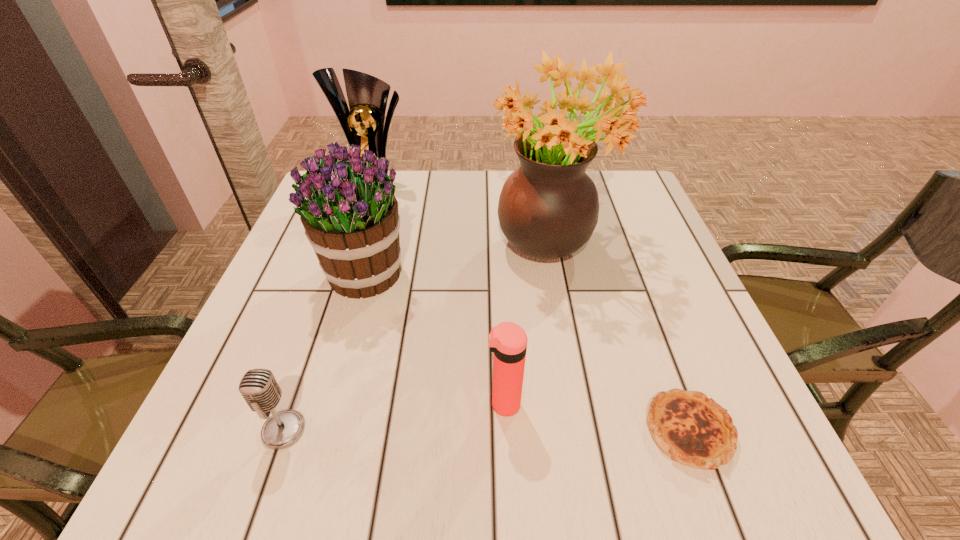
Identify the location of quiche that is at the right edge. The width and height of the screenshot is (960, 540). (692, 429).

Locate an element on the screen. object that is at the far left corner is located at coordinates (363, 125).

You are a GUI agent. You are given a task and a screenshot of the screen. Output one action in this format:
    pyautogui.click(x=<x>, y=<y>)
    Task: Click on the object that is at the near left corner
    The width and height of the screenshot is (960, 540).
    Given the screenshot: What is the action you would take?
    pyautogui.click(x=259, y=388)

The image size is (960, 540). I want to click on object present at the far right corner, so click(x=548, y=208).

Where is `object at the near right corner`? This screenshot has height=540, width=960. object at the near right corner is located at coordinates (692, 429).

The width and height of the screenshot is (960, 540). Find the location of `vacant space at the far edge of the desktop`. vacant space at the far edge of the desktop is located at coordinates (444, 188).

Find the location of a particular element. vacant space at the near edge of the desktop is located at coordinates (307, 462).

Where is `blank space at the left edge of the desktop`? The image size is (960, 540). blank space at the left edge of the desktop is located at coordinates (300, 261).

This screenshot has height=540, width=960. I want to click on vacant area at the right edge, so click(x=655, y=281).

This screenshot has height=540, width=960. What are the coordinates of `vacant space at the far right corner of the desktop` in the screenshot? It's located at (617, 208).